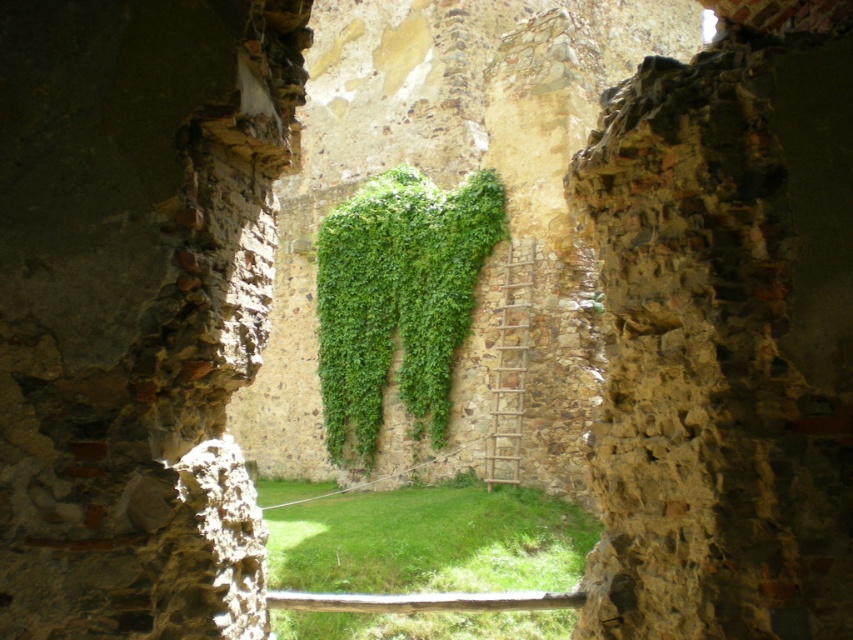
Is point (334, 636) positioned in front of point (445, 275)?

Yes, point (334, 636) is in front of point (445, 275).

Does green grass at center have a larger size compared to green leafy ivy at center?

No.

Where is `green grass at center`? Image resolution: width=853 pixels, height=640 pixels. green grass at center is located at coordinates (422, 538).